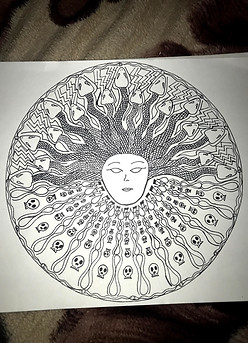
I want to click on rug, so click(x=112, y=43).